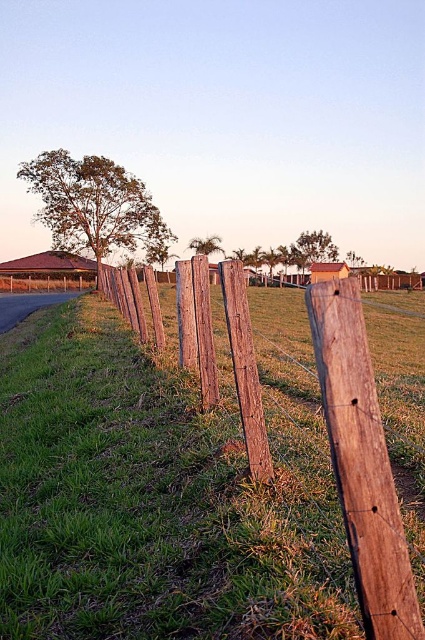
You are a painter standing in front of the wooden fence. You notice two posts at the center of the fence. One is labeled as brown wooden post at center and the other as weathered wood post at center. Which post is wider?

The brown wooden post at center is wider than the weathered wood post at center.

You are standing at the origin point in the image and want to walk towards the weathered wood fence at center. Which direction should you head to reach it?

The weathered wood fence at center is located at point (362,461), so you should head towards the lower right direction to reach it.